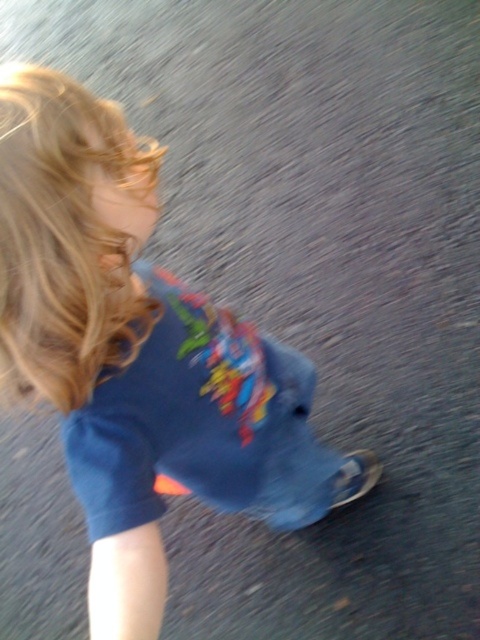
Question: Is blue cotton shirt at center positioned behind blonde curly hair at upper left?

Choices:
 (A) no
 (B) yes

Answer: (B)

Question: Which point is closer to the camera?

Choices:
 (A) blue cotton shirt at center
 (B) blonde curly hair at upper left

Answer: (B)

Question: Which object appears farthest from the camera in this image?

Choices:
 (A) blue cotton shirt at center
 (B) blonde curly hair at upper left

Answer: (A)

Question: Considering the relative positions of blue cotton shirt at center and blonde curly hair at upper left in the image provided, where is blue cotton shirt at center located with respect to blonde curly hair at upper left?

Choices:
 (A) right
 (B) left

Answer: (A)

Question: From the image, what is the correct spatial relationship of blue cotton shirt at center in relation to blonde curly hair at upper left?

Choices:
 (A) left
 (B) right

Answer: (B)

Question: Which of the following is the farthest from the observer?

Choices:
 (A) click(x=104, y=317)
 (B) click(x=55, y=387)

Answer: (A)